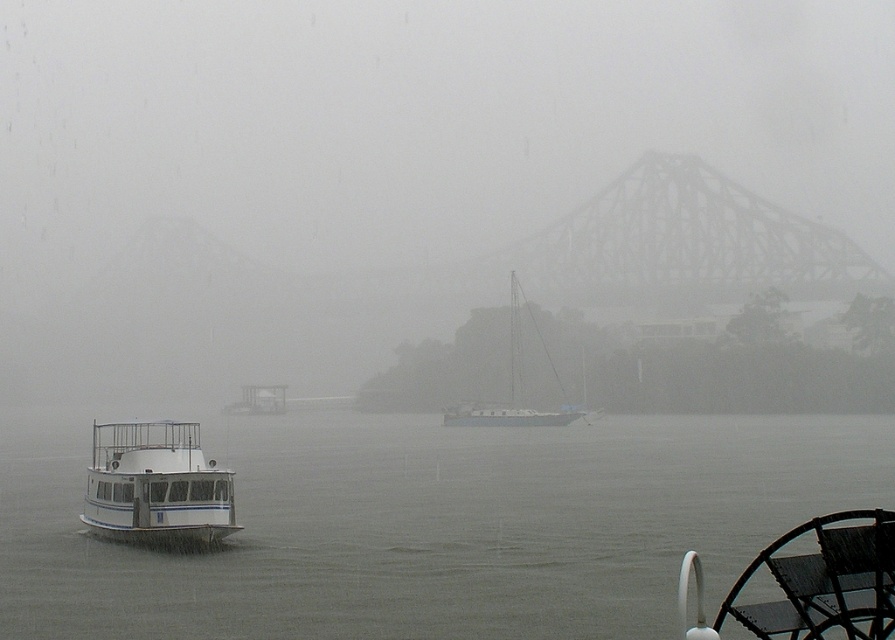
Question: Is white matte water at center above white glossy boat at left?

Choices:
 (A) no
 (B) yes

Answer: (A)

Question: Is white matte water at center below white glossy boat at left?

Choices:
 (A) no
 (B) yes

Answer: (B)

Question: Estimate the real-world distances between objects in this image. Which object is farther from the white metal bridge at upper center?

Choices:
 (A) teal matte sailboat at center
 (B) white glossy boat at left
 (C) white matte water at center

Answer: (B)

Question: Which point is closer to the camera?

Choices:
 (A) 48,458
 (B) 655,186

Answer: (A)

Question: In this image, where is white matte water at center located relative to teal matte sailboat at center?

Choices:
 (A) right
 (B) left

Answer: (B)

Question: Estimate the real-world distances between objects in this image. Which object is closer to the white glossy boat at left?

Choices:
 (A) white metal bridge at upper center
 (B) white matte water at center

Answer: (B)